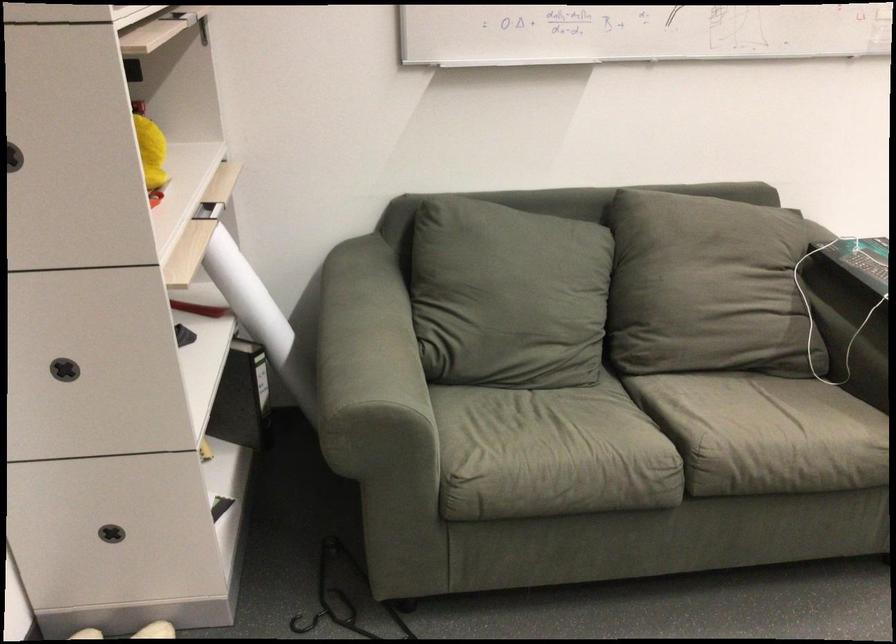
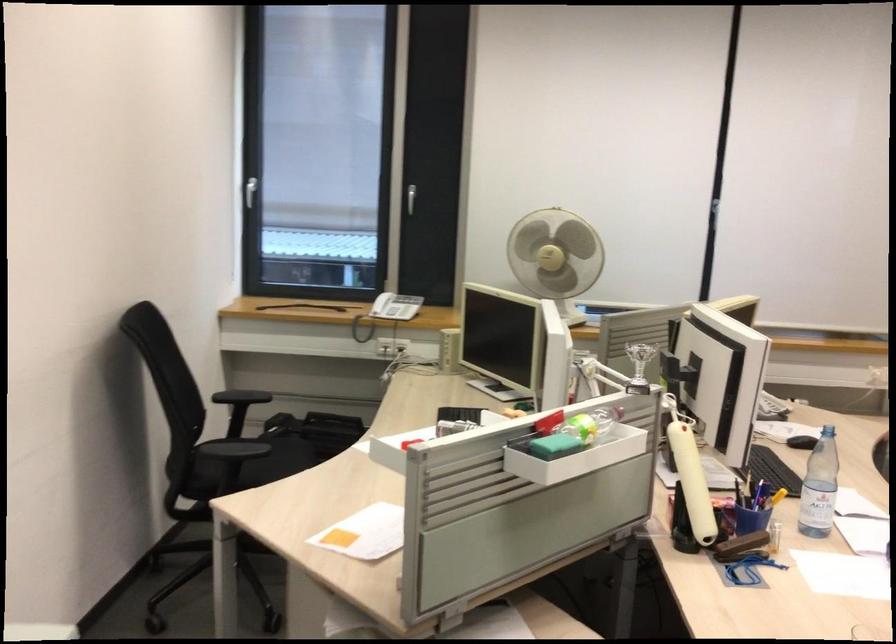
Question: The first image is from the beginning of the video and the second image is from the end. How did the camera likely rotate when shooting the video?

Choices:
 (A) Left
 (B) Right
 (C) Up
 (D) Down

Answer: (B)